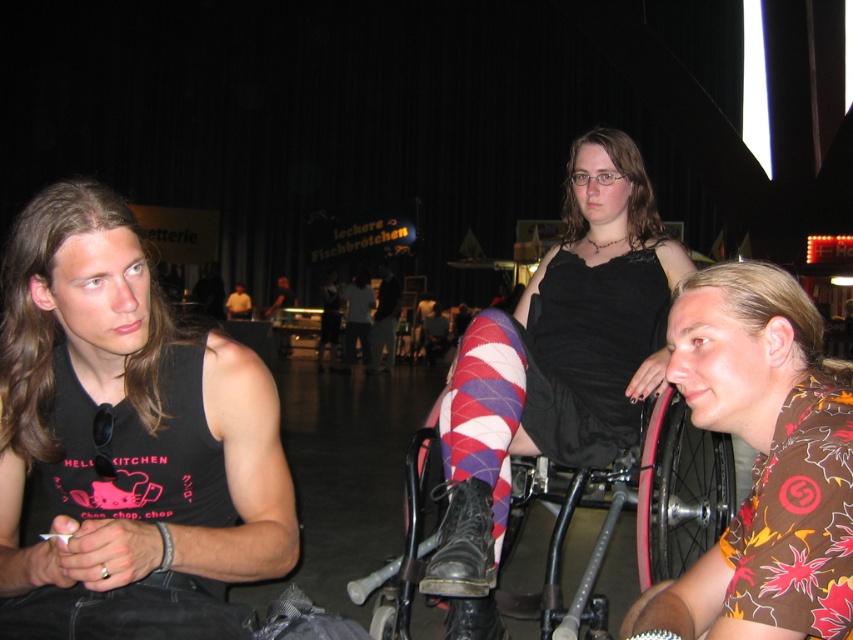
You are a photographer at the event and need to adjust the lighting so that both the matte black tank top at center and the striped tights at center are evenly illuminated. Since the tank top is matte and the tights are striped, which object might require more light to achieve the same brightness in the photo?

The matte black tank top at center requires more light because matte surfaces generally need more illumination to appear bright in photos compared to the striped tights at center, which might have reflective properties that catch light more easily.

You are a photographer standing at the back of the event venue. You want to take a photo of the matte black tank top at center. The minimum distance required for your camera to focus properly is 5 feet. Can you take a clear photo from your current position?

The distance between you and the matte black tank top at center is 4.58 feet, which is less than the 5 feet minimum required for proper focus. Therefore, you cannot take a clear photo from your current position.

You are at an event where you need to hand out flyers to both people wearing the brown floral shirt at right and the matte black tank top at left. Based on their height, which person should you aim the flyers higher to avoid bending down?

You should aim the flyers higher for the matte black tank top at left because the brown floral shirt at right is not as tall as the matte black tank top at left.